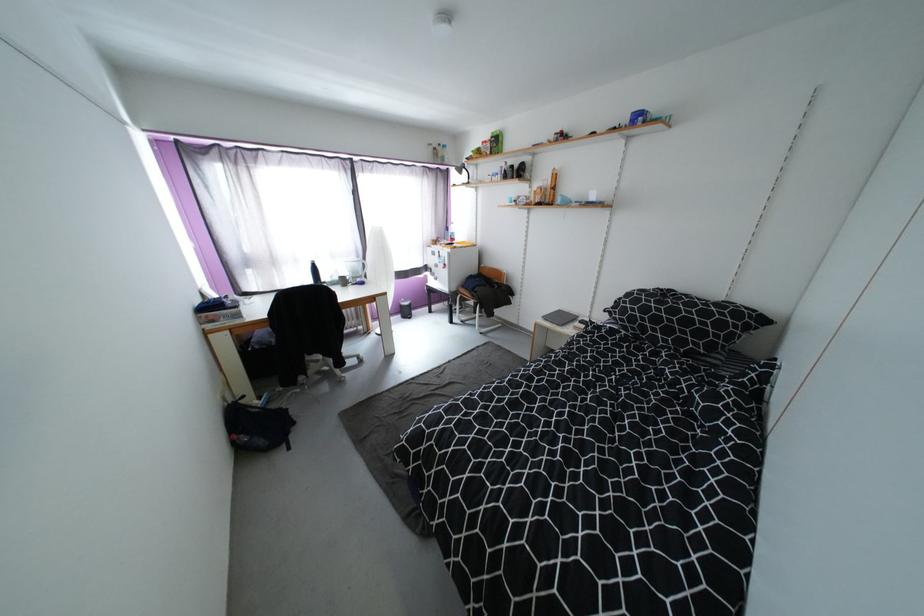
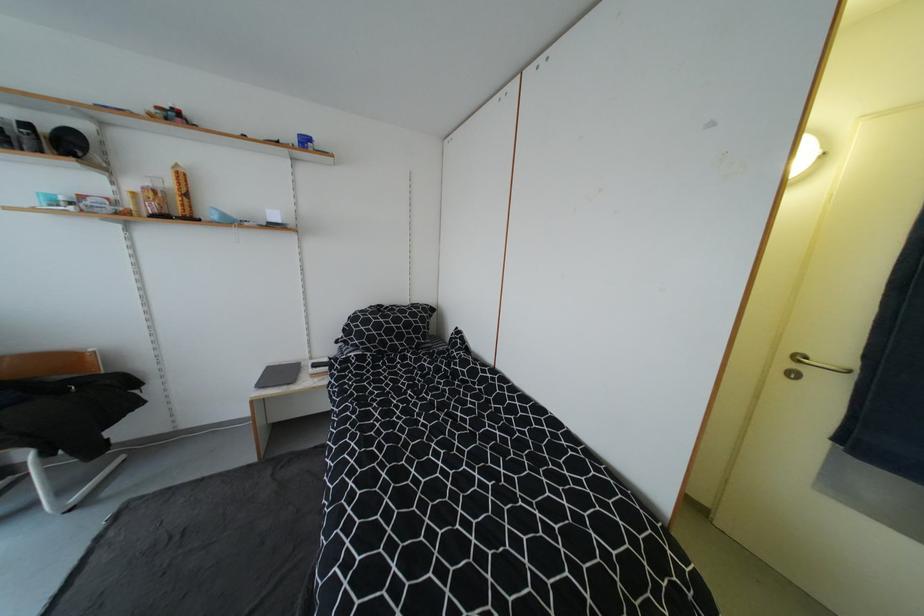
The point at (x=643, y=119) is marked in the first image. Where is the corresponding point in the second image?

(311, 143)